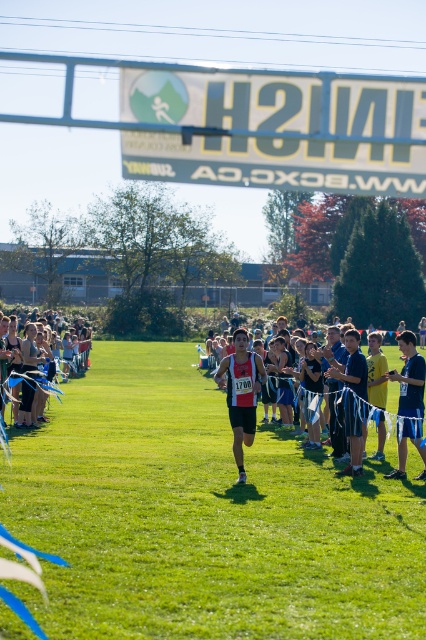
Based on the scene description, can you determine which object is larger between the white plastic banner at upper center and the matte black running suit at center?

The white plastic banner at upper center is smaller than the matte black running suit at center, so the matte black running suit at center is larger.

You are a photographer at the finish line of a marathon. You want to take a photo of the matte black running suit at center without the white plastic banner at upper center blocking it. Is this possible?

The white plastic banner at upper center is in front of the matte black running suit at center, so it is blocking the view. To take a photo of the matte black running suit at center without the banner blocking it, you would need to reposition yourself or the banner so that the banner is no longer in front of the suit.